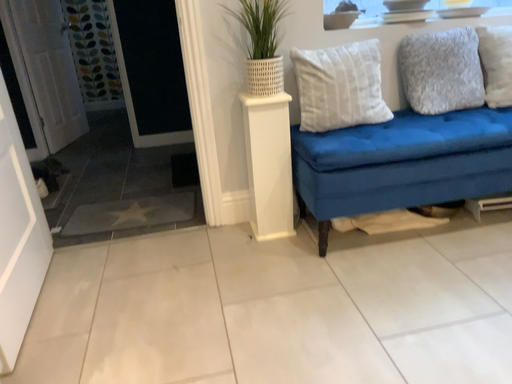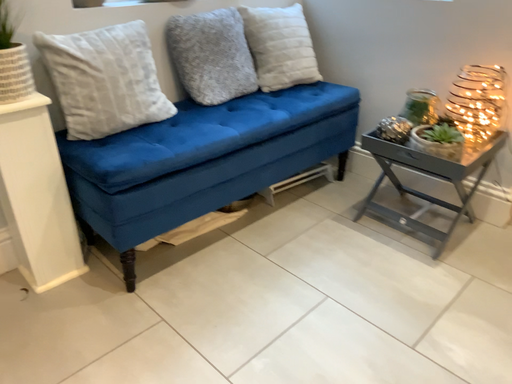
Question: How did the camera likely rotate when shooting the video?

Choices:
 (A) rotated left
 (B) rotated right

Answer: (B)